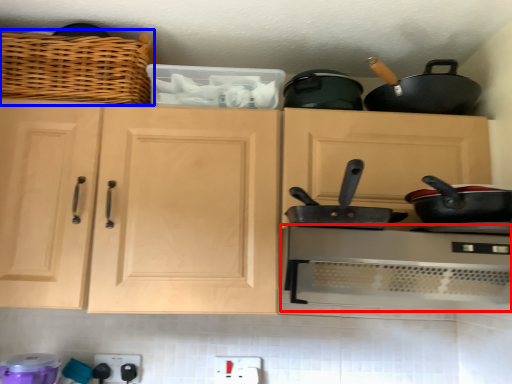
Question: Which point is closer to the camera, home appliance (highlighted by a red box) or basket (highlighted by a blue box)?

Choices:
 (A) home appliance
 (B) basket

Answer: (A)